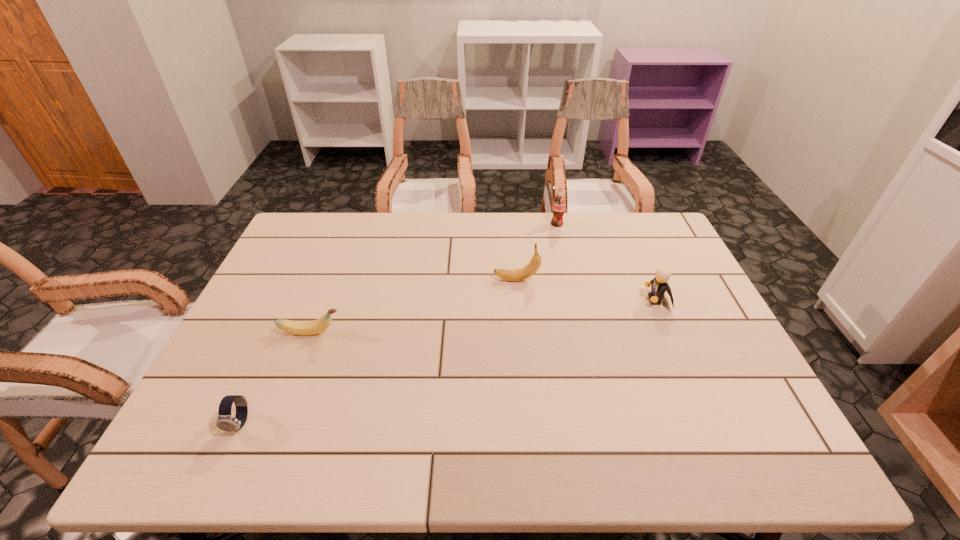
At what (x,y) coordinates should I click in order to perform the action: click on free space located at the start of the peel on the farther banana. Please return your answer as a coordinate pair (x, y). This screenshot has width=960, height=540. Looking at the image, I should click on (396, 280).

Where is `vacant space located 0.110m at the start of the peel on the farther banana`? The width and height of the screenshot is (960, 540). vacant space located 0.110m at the start of the peel on the farther banana is located at coordinates pos(457,280).

Find the location of a particular element. Image resolution: width=960 pixels, height=540 pixels. vacant point located at the start of the peel on the farther banana is located at coordinates click(x=470, y=280).

Locate an element on the screen. The image size is (960, 540). free space located on the front-facing side of the third nearest object is located at coordinates (x=627, y=300).

Identify the location of free location located 0.350m on the front-facing side of the third nearest object. The height and width of the screenshot is (540, 960). (521, 300).

Locate an element on the screen. vacant space located on the front-facing side of the third nearest object is located at coordinates (592, 300).

In order to click on vacant space situated at the stem of the shorter banana in this screenshot , I will do `click(389, 333)`.

Identify the location of object present at the far edge. This screenshot has width=960, height=540. (559, 204).

The width and height of the screenshot is (960, 540). Identify the location of object that is positioned at the near edge. (226, 422).

At what (x,y) coordinates should I click in order to perform the action: click on banana at the left edge. Please return your answer as a coordinate pair (x, y). The width and height of the screenshot is (960, 540). Looking at the image, I should click on (293, 327).